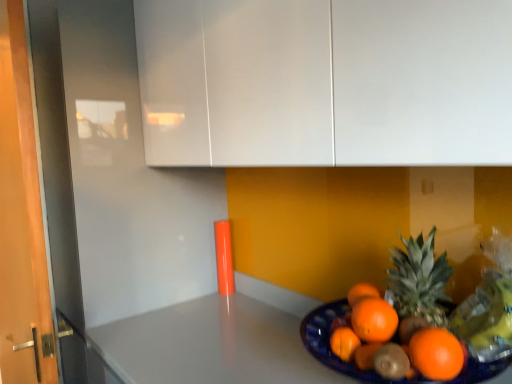
The width and height of the screenshot is (512, 384). I want to click on free space above blue glossy plate at lower right (from a real-world perspective), so click(x=291, y=284).